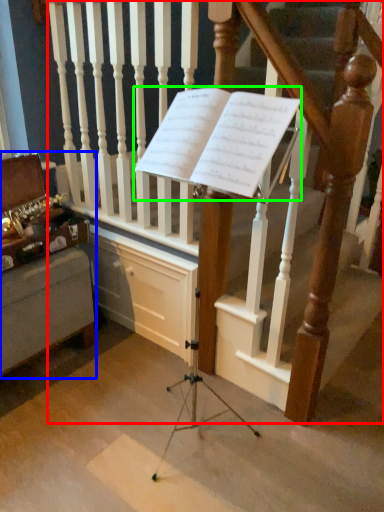
Question: Estimate the real-world distances between objects in this image. Which object is closer to stairs (highlighted by a red box), furniture (highlighted by a blue box) or sheet music (highlighted by a green box)?

Choices:
 (A) furniture
 (B) sheet music

Answer: (B)